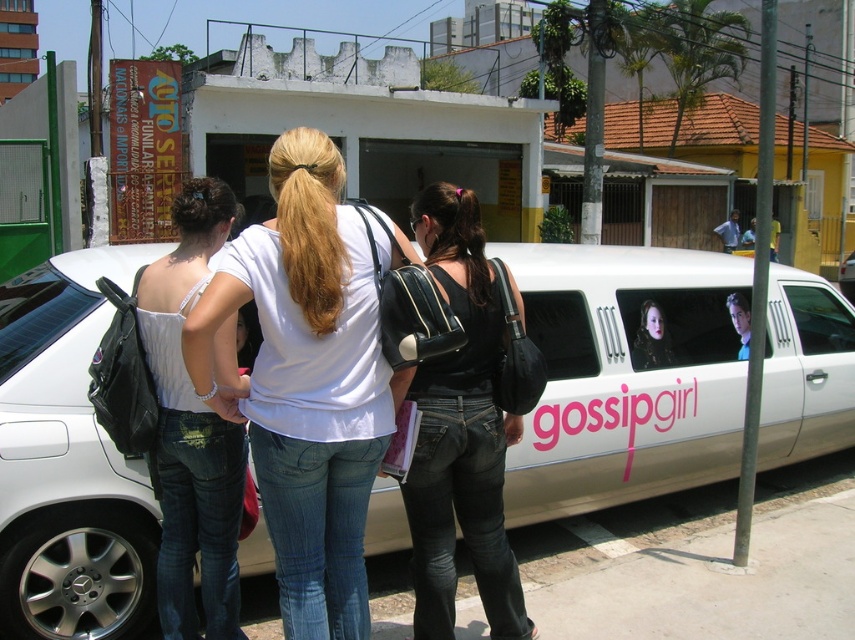
Question: Which of the following is the farthest from the observer?

Choices:
 (A) (327, 200)
 (B) (157, 308)
 (C) (513, 420)

Answer: (C)

Question: Which object is the farthest from the smooth black hair at center?

Choices:
 (A) white glossy limousine at center
 (B) white matte shirt at center
 (C) white cotton tank top at center
 (D) black leather backpack at center

Answer: (C)

Question: Which of these objects is positioned farthest from the white matte shirt at center?

Choices:
 (A) white glossy limousine at center
 (B) white cotton tank top at center
 (C) black leather backpack at center
 (D) smooth black hair at center

Answer: (A)

Question: Where is white glossy limousine at center located in relation to white cotton tank top at center in the image?

Choices:
 (A) left
 (B) right

Answer: (B)

Question: Is the position of white matte shirt at center more distant than that of white cotton tank top at center?

Choices:
 (A) yes
 (B) no

Answer: (B)

Question: Can you confirm if white matte shirt at center is positioned to the right of black leather backpack at center?

Choices:
 (A) no
 (B) yes

Answer: (A)